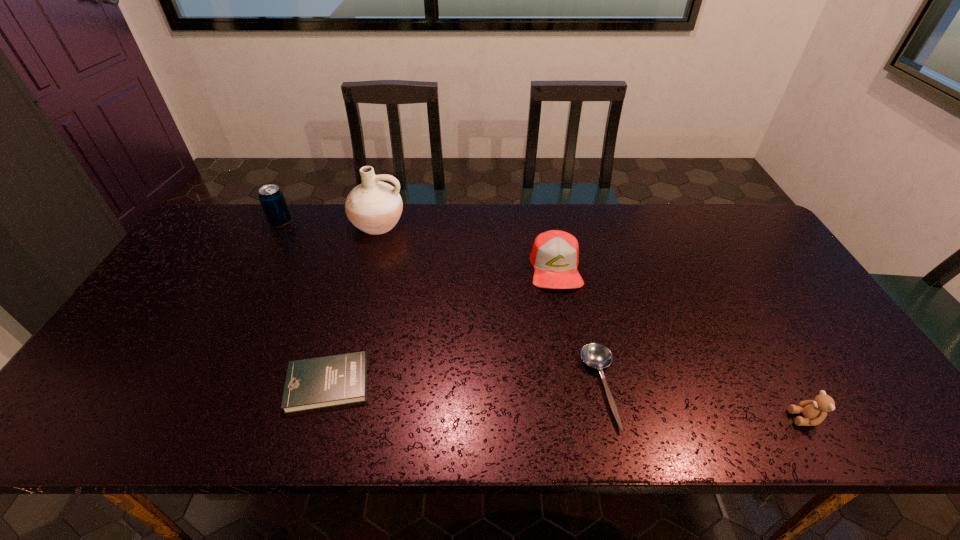
The width and height of the screenshot is (960, 540). I want to click on the tallest object, so click(374, 207).

In order to click on the fifth shortest object in this screenshot , I will do click(x=271, y=197).

The image size is (960, 540). I want to click on soda can, so click(x=271, y=197).

The width and height of the screenshot is (960, 540). In order to click on the third farthest object in this screenshot , I will do `click(555, 254)`.

Locate an element on the screen. the rightmost object is located at coordinates (814, 411).

This screenshot has width=960, height=540. In order to click on teddy bear in this screenshot , I will do `click(814, 411)`.

Where is `book`? This screenshot has height=540, width=960. book is located at coordinates (329, 381).

At what (x,y) coordinates should I click in order to perform the action: click on ladle. Please return your answer as a coordinate pair (x, y). Image resolution: width=960 pixels, height=540 pixels. Looking at the image, I should click on (595, 355).

Identify the location of vacant space situated to pour from the handle of the tallest object. point(367,264).

Where is `vacant space located on the front of the fifth shortest object`? This screenshot has width=960, height=540. vacant space located on the front of the fifth shortest object is located at coordinates (267, 249).